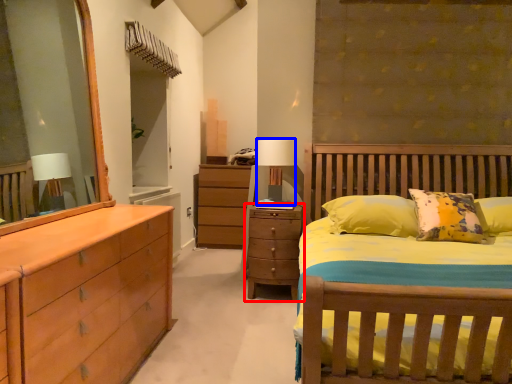
Question: Which object is closer to the camera taking this photo, chest of drawers (highlighted by a red box) or table lamp (highlighted by a blue box)?

Choices:
 (A) chest of drawers
 (B) table lamp

Answer: (A)